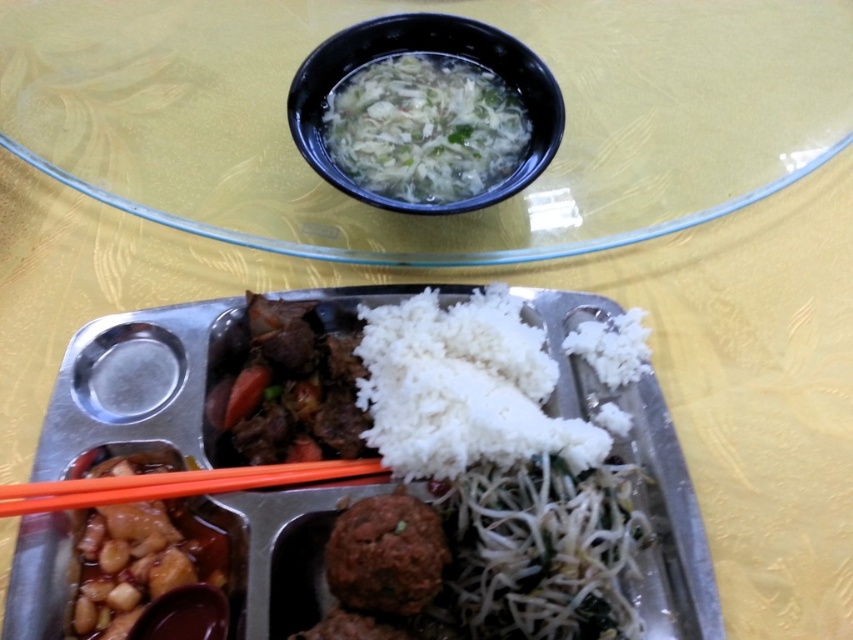
Between point (24, 157) and point (306, 614), which one is positioned in front?

Point (306, 614)

Is point (213, 214) closer to viewer compared to point (556, 413)?

No, (213, 214) is behind (556, 413).

The width and height of the screenshot is (853, 640). In order to click on transparent glass bowl at upper center in this screenshot , I will do `click(422, 216)`.

Which is more to the right, white matte rice at center or black plastic bowl at upper center?

Positioned to the right is white matte rice at center.

Can you confirm if white matte rice at center is wider than black plastic bowl at upper center?

No.

Is point (492, 429) closer to camera compared to point (492, 196)?

Yes, it is in front of point (492, 196).

Where is `white matte rice at center`? This screenshot has width=853, height=640. white matte rice at center is located at coordinates (463, 387).

Can you confirm if black plastic bowl at upper center is smaller than orange plastic chopsticks at lower center?

No, black plastic bowl at upper center is not smaller than orange plastic chopsticks at lower center.

Which of these two, black plastic bowl at upper center or orange plastic chopsticks at lower center, stands taller?

black plastic bowl at upper center

Who is more distant from viewer, (x=312, y=68) or (x=178, y=480)?

Positioned behind is point (x=312, y=68).

This screenshot has height=640, width=853. What are the coordinates of `black plastic bowl at upper center` in the screenshot? It's located at (427, 51).